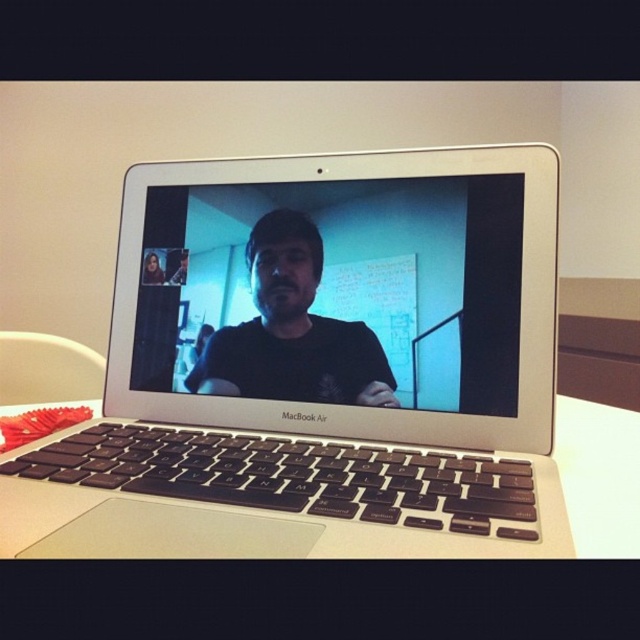
What do you see at coordinates (291, 330) in the screenshot?
I see `black matte shirt at center` at bounding box center [291, 330].

Which is more to the right, black matte shirt at center or white matte table at center?

From the viewer's perspective, white matte table at center appears more on the right side.

What do you see at coordinates (291, 330) in the screenshot? This screenshot has width=640, height=640. I see `black matte shirt at center` at bounding box center [291, 330].

Where is `black matte shirt at center`? The width and height of the screenshot is (640, 640). black matte shirt at center is located at coordinates click(291, 330).

Can you confirm if silver metallic laptop at center is bigger than matte black laptop at center?

Yes, silver metallic laptop at center is bigger than matte black laptop at center.

Between silver metallic laptop at center and matte black laptop at center, which one has less height?

Standing shorter between the two is matte black laptop at center.

Between point (152, 556) and point (509, 248), which one is positioned in front?

Point (152, 556)

This screenshot has width=640, height=640. In order to click on silver metallic laptop at center in this screenshot , I will do `click(317, 365)`.

Is silver metallic laptop at center below white matte table at center?

Incorrect, silver metallic laptop at center is not positioned below white matte table at center.

The width and height of the screenshot is (640, 640). What are the coordinates of `silver metallic laptop at center` in the screenshot? It's located at (317, 365).